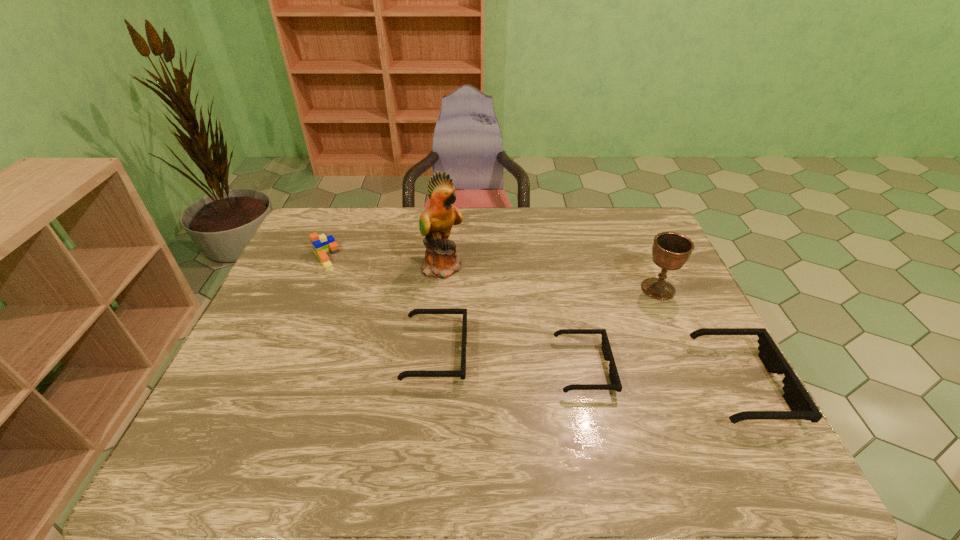
Image resolution: width=960 pixels, height=540 pixels. Find the location of `free point that keeps the sunglassess evenly spaced on the left`. free point that keeps the sunglassess evenly spaced on the left is located at coordinates (297, 338).